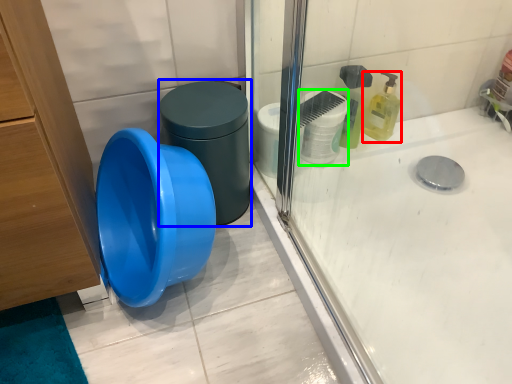
Question: Which is nearer to the cleaning product (highlighted by a red box)? potty (highlighted by a blue box) or toilet paper (highlighted by a green box).

Choices:
 (A) potty
 (B) toilet paper

Answer: (B)